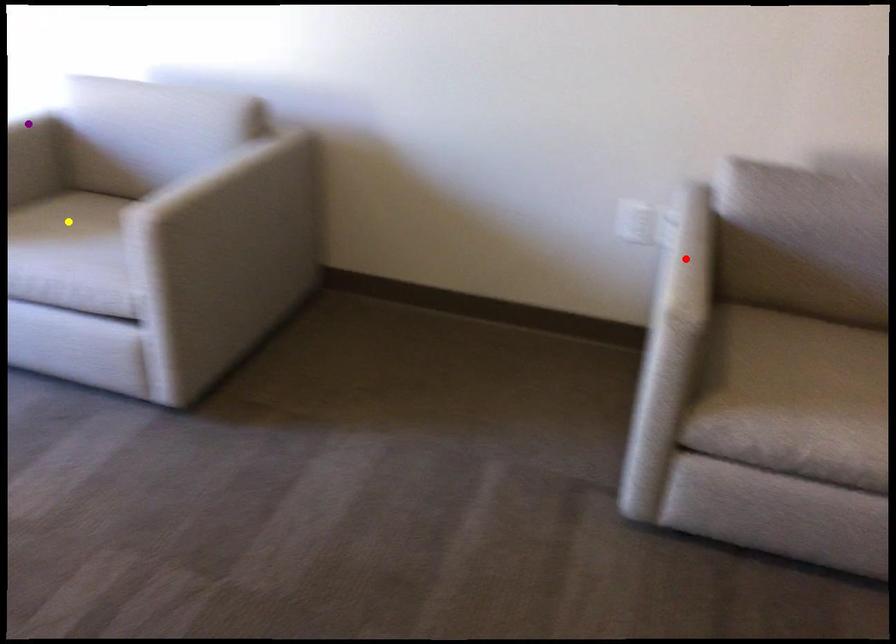
Order these from nearest to farthest:
A) yellow point
B) purple point
C) red point

red point < yellow point < purple point